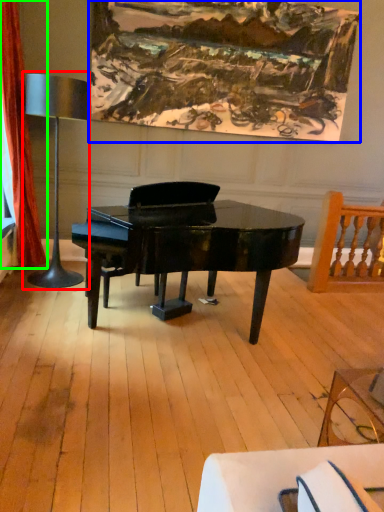
Question: Which object is the farthest from table lamp (highlighted by a red box)? Choose among these: picture frame (highlighted by a blue box) or curtain (highlighted by a green box).

Choices:
 (A) picture frame
 (B) curtain

Answer: (A)